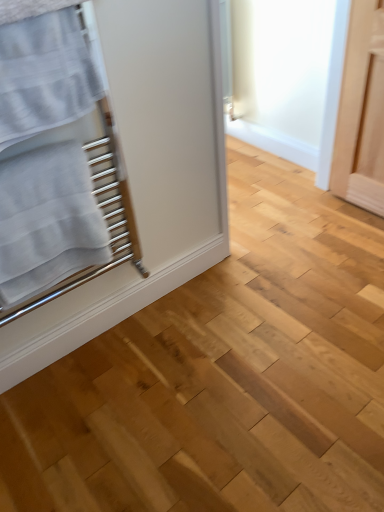
You are a GUI agent. You are given a task and a screenshot of the screen. Output one action in this format:
    pyautogui.click(x=<x>, y=<y>)
    Task: Click on the vacant area situated below white textured towel at left, the 1th bath towel in the top-to-bottom sequence (from a real-world perspective)
    The width and height of the screenshot is (384, 512).
    Given the screenshot: What is the action you would take?
    pyautogui.click(x=111, y=340)